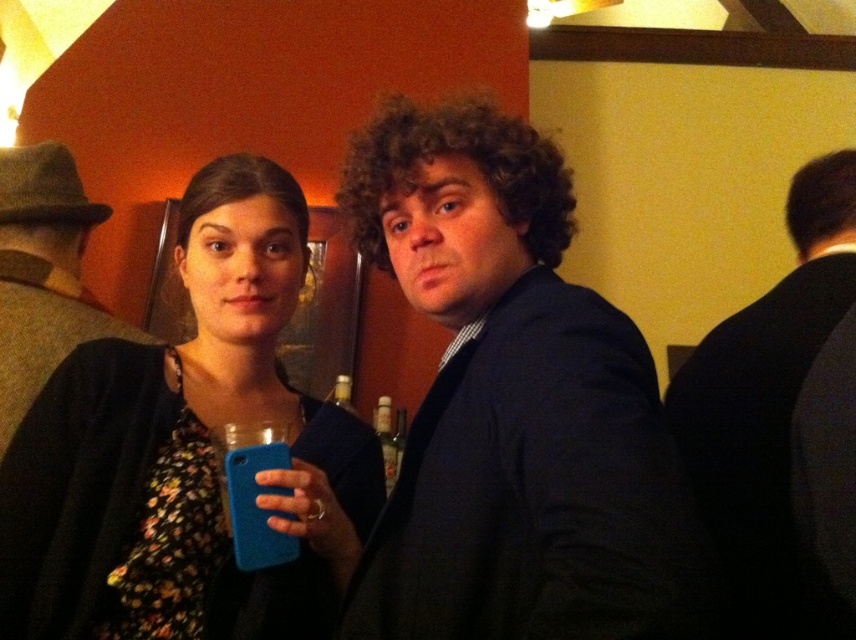
You are a photographer adjusting your camera settings to focus on the matte blue phone at center and the dark blue suit at right. Which object should you focus on first to ensure it appears sharp in the photo?

You should focus on the matte blue phone at center first because it is closer to the viewer than the dark blue suit at right, so focusing on the closer object ensures it will be sharp.

From the picture: You are standing in the room and want to determine which of the two points, point (462, 588) or point (345, 445), is closer to you. Based on the scene, which point is nearer?

Point (462, 588) is closer to the camera than point (345, 445), so it is the nearer one.

Consider the image. What are the coordinates of the matte blue phone at center?

The coordinates of the matte blue phone at center are 0.706 in the x direction and 0.218 in the y direction.